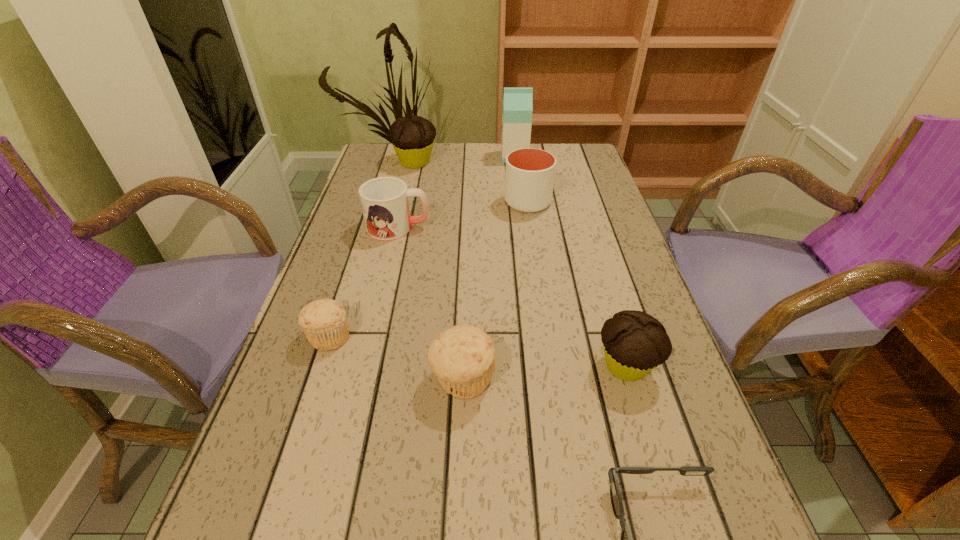
Identify the location of muffin located in the far edge section of the desktop. (412, 138).

The width and height of the screenshot is (960, 540). What are the coordinates of `mug at the left edge` in the screenshot? It's located at (384, 200).

The width and height of the screenshot is (960, 540). In order to click on object that is at the right edge in this screenshot , I will do `click(634, 342)`.

Identify the location of object present at the far left corner. This screenshot has height=540, width=960. (412, 138).

The image size is (960, 540). I want to click on vacant space at the far edge of the desktop, so 502,178.

At what (x,y) coordinates should I click in order to perform the action: click on vacant space at the left edge. Please return your answer as a coordinate pair (x, y). Looking at the image, I should click on (380, 254).

This screenshot has height=540, width=960. Identify the location of free space at the right edge of the desktop. (591, 204).

Where is `vacant space at the far right corner of the desktop`? This screenshot has width=960, height=540. vacant space at the far right corner of the desktop is located at coordinates (579, 144).

The height and width of the screenshot is (540, 960). Find the location of `blank region between the third muffin from left to right and the farthest muffin`. blank region between the third muffin from left to right and the farthest muffin is located at coordinates (439, 271).

This screenshot has width=960, height=540. Identify the location of vacant area that lies between the white milk carton and the mug. [x=456, y=192].